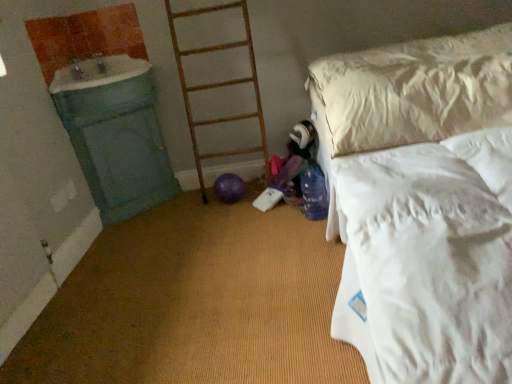
Question: Does wooden ladder at center have a greater width compared to green painted wood sink at left?

Choices:
 (A) no
 (B) yes

Answer: (A)

Question: Is wooden ladder at center taller than green painted wood sink at left?

Choices:
 (A) no
 (B) yes

Answer: (B)

Question: Is wooden ladder at center facing towards green painted wood sink at left?

Choices:
 (A) yes
 (B) no

Answer: (B)

Question: Is wooden ladder at center positioned with its back to green painted wood sink at left?

Choices:
 (A) no
 (B) yes

Answer: (A)

Question: From a real-world perspective, is wooden ladder at center physically above green painted wood sink at left?

Choices:
 (A) no
 (B) yes

Answer: (A)

Question: Considering the positions of point (51, 91) and point (212, 8), is point (51, 91) closer or farther from the camera than point (212, 8)?

Choices:
 (A) closer
 (B) farther

Answer: (A)

Question: From the image's perspective, is green painted wood sink at left positioned above or below wooden ladder at center?

Choices:
 (A) above
 (B) below

Answer: (A)

Question: In terms of height, does green painted wood sink at left look taller or shorter compared to wooden ladder at center?

Choices:
 (A) tall
 (B) short

Answer: (B)

Question: Considering the positions of green painted wood sink at left and wooden ladder at center in the image, is green painted wood sink at left wider or thinner than wooden ladder at center?

Choices:
 (A) thin
 (B) wide

Answer: (B)

Question: Considering the relative positions of wooden ladder at center and green painted wood sink at left in the image provided, is wooden ladder at center to the left or to the right of green painted wood sink at left?

Choices:
 (A) right
 (B) left

Answer: (A)

Question: Choose the correct answer: Is wooden ladder at center inside green painted wood sink at left or outside it?

Choices:
 (A) inside
 (B) outside

Answer: (B)

Question: Is wooden ladder at center wider or thinner than green painted wood sink at left?

Choices:
 (A) wide
 (B) thin

Answer: (B)

Question: Relative to green painted wood sink at left, is wooden ladder at center in front or behind?

Choices:
 (A) behind
 (B) front

Answer: (A)

Question: Considering the positions of white soft bed at right and green painted wood sink at left in the image, is white soft bed at right bigger or smaller than green painted wood sink at left?

Choices:
 (A) big
 (B) small

Answer: (A)

Question: Is white soft bed at right taller or shorter than green painted wood sink at left?

Choices:
 (A) tall
 (B) short

Answer: (A)